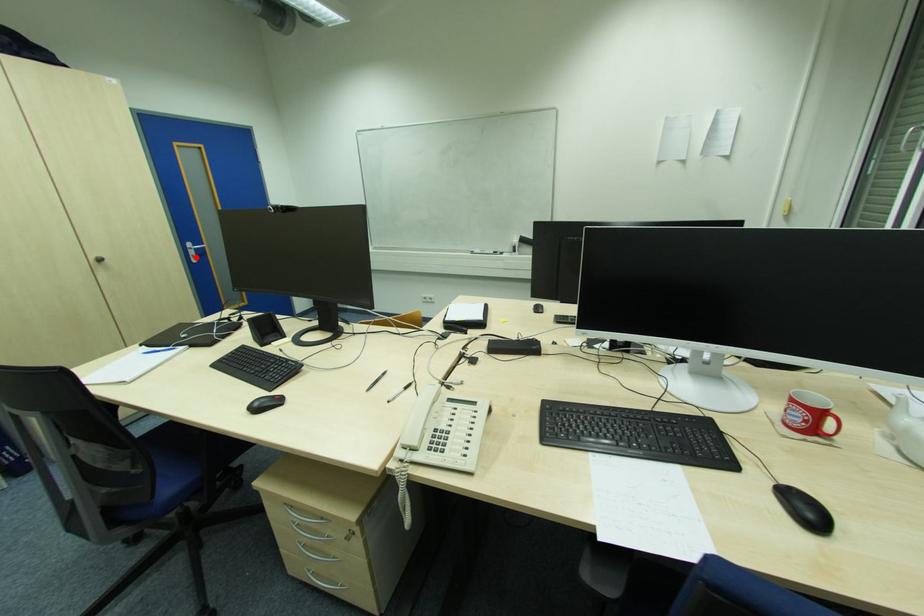
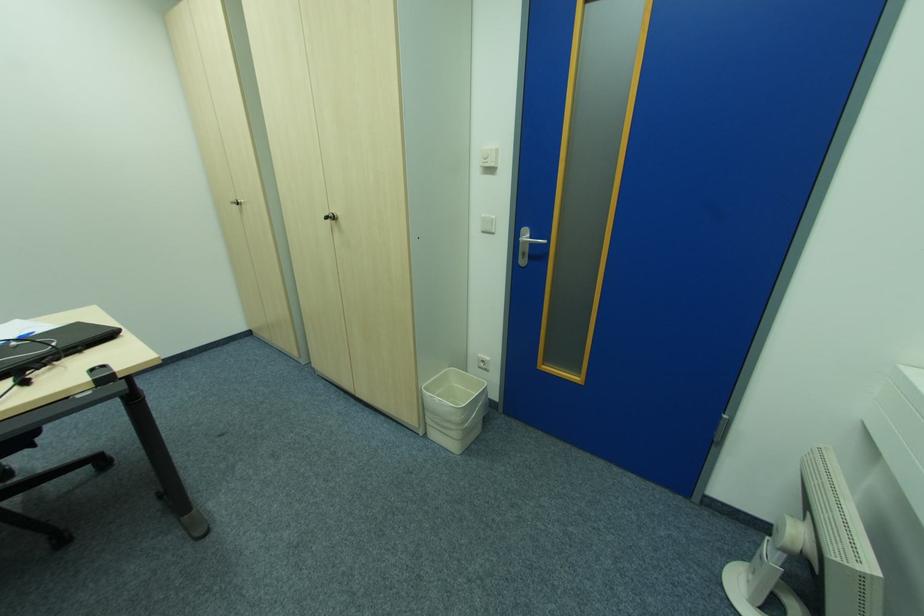
In the second image, find the point that corresponds to the highlighted location in the first image.

(526, 256)